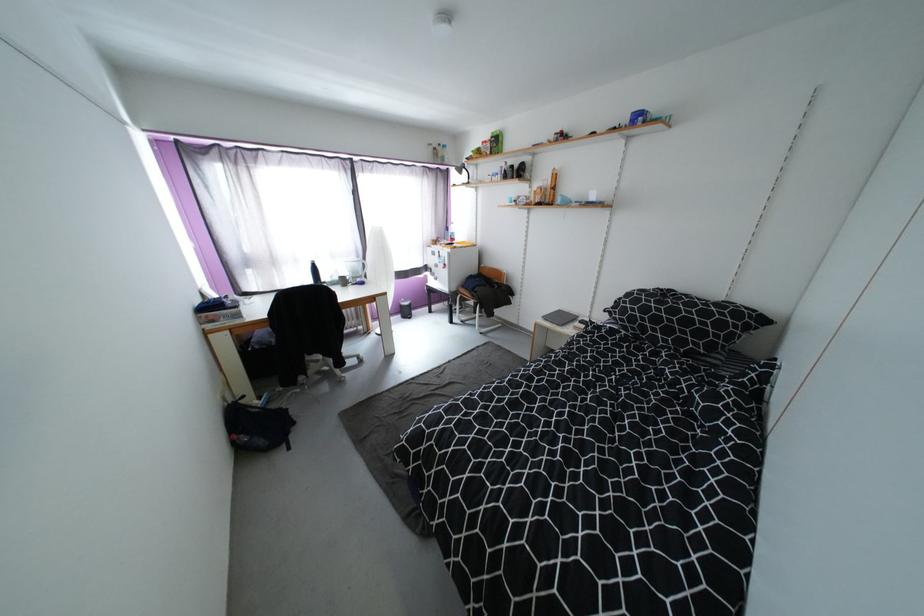
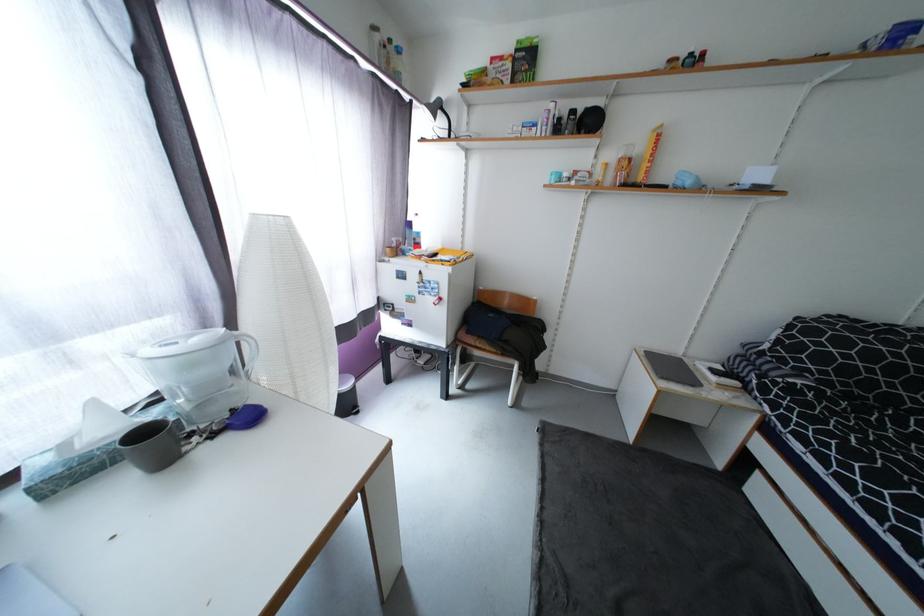
Locate, in the second image, the point that corresponds to the point at 554,184 in the first image.

(647, 151)